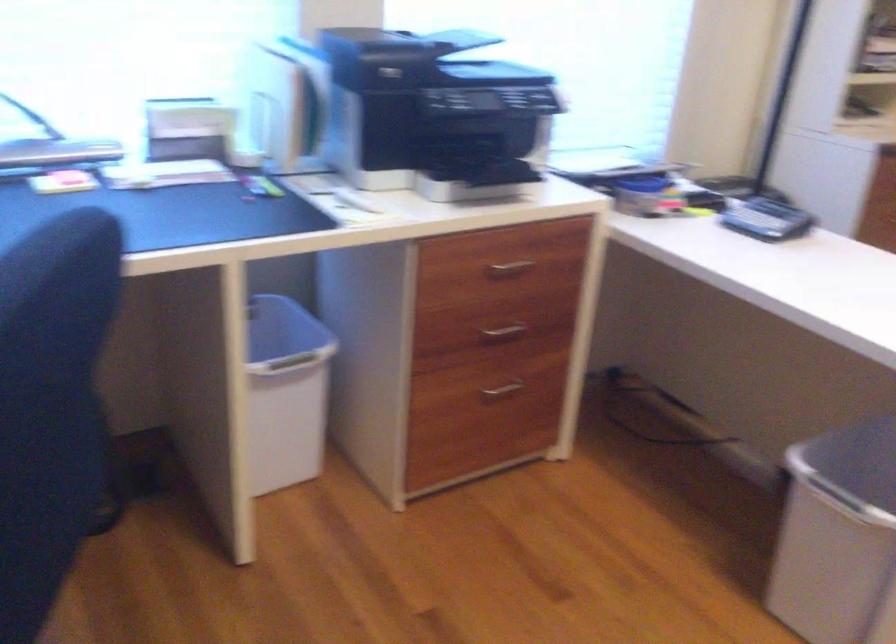
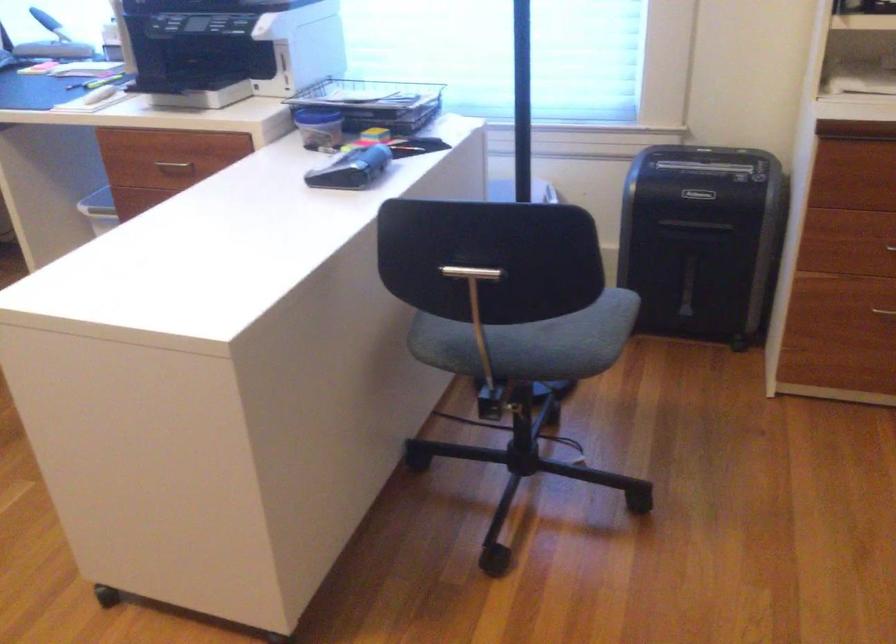
Question: I am providing you with two images of the same scene from different viewpoints. Please identify which objects are invisible in image2.

Choices:
 (A) metal drawer handle
 (B) silver drawer handle
 (C) metal T-handle
 (D) brass cabinet handle

Answer: (B)